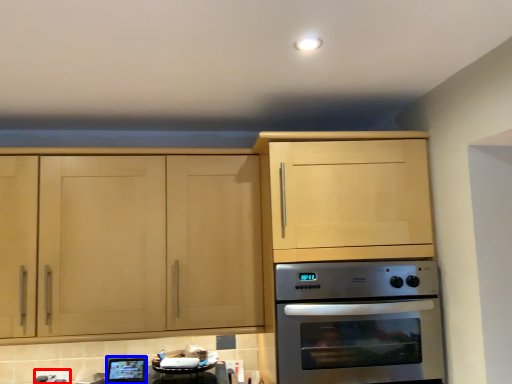
Question: Which of the following is the closest to the observer, electric outlet (highlighted by a red box) or appliance (highlighted by a blue box)?

Choices:
 (A) electric outlet
 (B) appliance

Answer: (B)